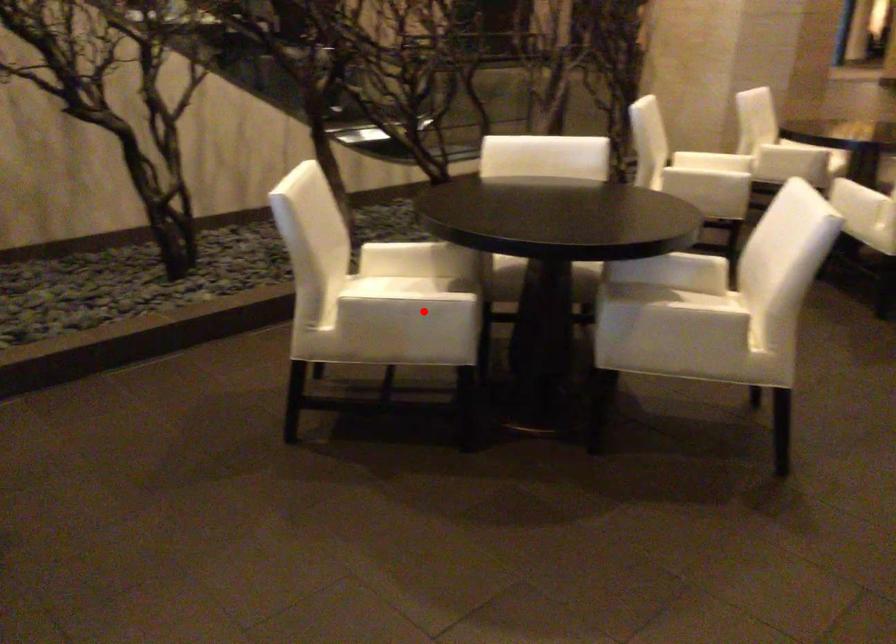
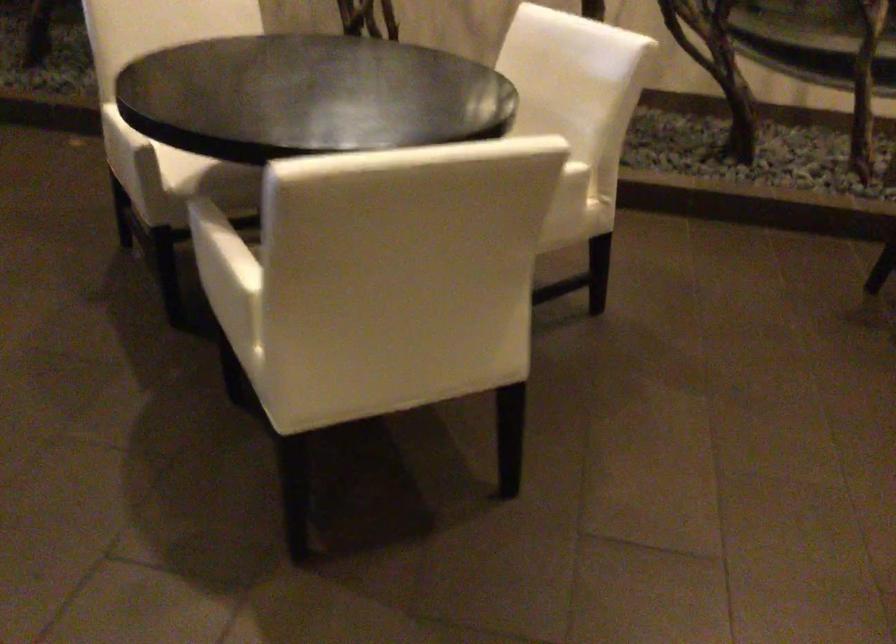
Locate, in the second image, the point that corresponds to the highlighted location in the first image.

(118, 138)